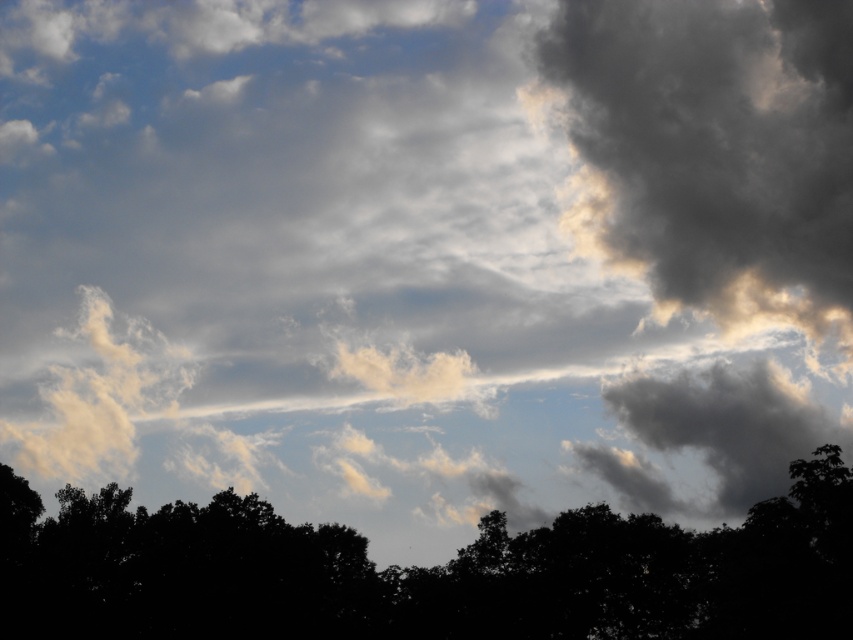
Question: Does black matte tree at bottom appear over dark gray fluffy cloud at upper right?

Choices:
 (A) no
 (B) yes

Answer: (A)

Question: Which object is closer to the camera taking this photo?

Choices:
 (A) black matte tree at bottom
 (B) dark gray fluffy cloud at upper right

Answer: (A)

Question: Is black matte tree at bottom bigger than dark gray fluffy cloud at upper right?

Choices:
 (A) no
 (B) yes

Answer: (B)

Question: Where is black matte tree at bottom located in relation to dark gray fluffy cloud at upper right in the image?

Choices:
 (A) right
 (B) left

Answer: (B)